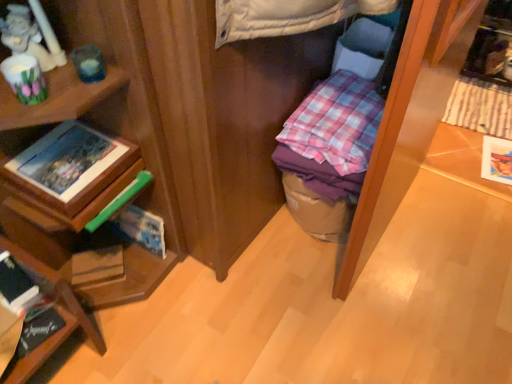
You are a GUI agent. You are given a task and a screenshot of the screen. Output one action in this format:
    pyautogui.click(x=<x>, y=<y>)
    Task: Click on the vacant area that is situated to the right of matte brown book at lower left, which is the 3th paperback book in right-to-left order
    The height and width of the screenshot is (384, 512).
    Given the screenshot: What is the action you would take?
    pyautogui.click(x=161, y=294)